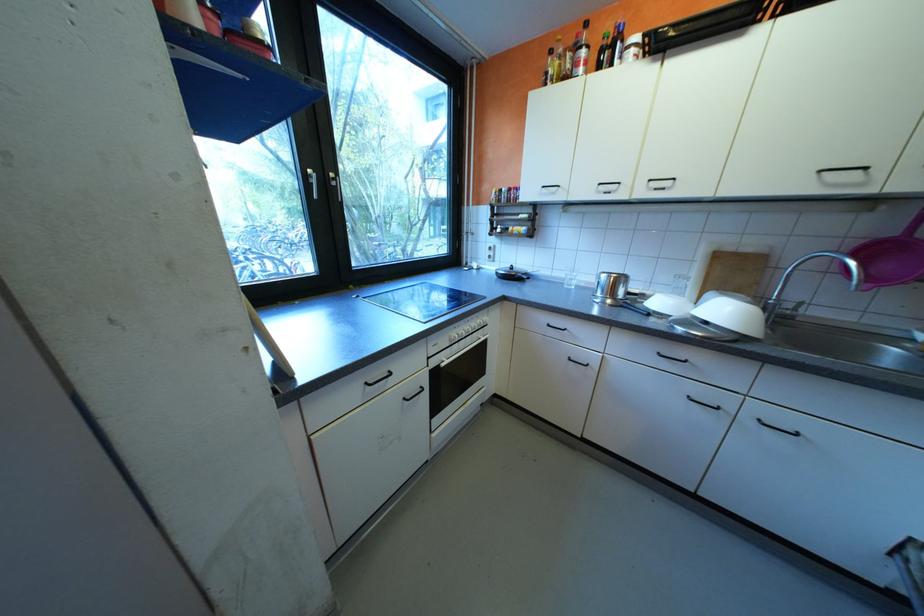
Find the location of a particular element. The image size is (924, 616). white control knob is located at coordinates (453, 336).